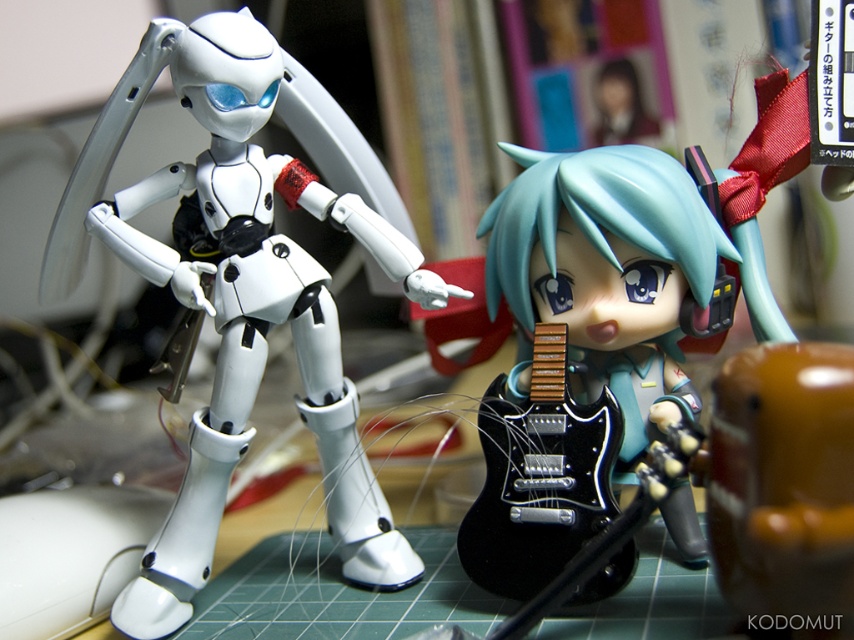
Is white matte robot at left further to the viewer compared to semi-glossy black guitar at center?

Yes.

Which of these two, white matte robot at left or semi-glossy black guitar at center, stands shorter?

Standing shorter between the two is semi-glossy black guitar at center.

Which is in front, point (329, 376) or point (607, 566)?

Positioned in front is point (607, 566).

You are a GUI agent. You are given a task and a screenshot of the screen. Output one action in this format:
    pyautogui.click(x=<x>, y=<y>)
    Task: Click on the white matte robot at left
    This screenshot has width=854, height=640.
    Given the screenshot: What is the action you would take?
    [x=244, y=285]

Which is in front, point (695, 410) or point (560, 525)?

Point (560, 525)

Does semi-glossy black guitar at center have a greater width compared to black glossy electric guitar at center?

Indeed, semi-glossy black guitar at center has a greater width compared to black glossy electric guitar at center.

Who is more distant from viewer, [670,406] or [494,515]?

The point [670,406] is more distant.

Find the location of a particular element. semi-glossy black guitar at center is located at coordinates (612, 276).

Between point (121, 612) and point (507, 596), which one is positioned behind?

The point (121, 612) is behind.

Does white matte robot at left have a lesser width compared to black glossy electric guitar at center?

In fact, white matte robot at left might be wider than black glossy electric guitar at center.

Consider the image. Who is more forward, (402, 541) or (524, 404)?

Point (524, 404) is in front.

This screenshot has height=640, width=854. I want to click on white matte robot at left, so click(x=244, y=285).